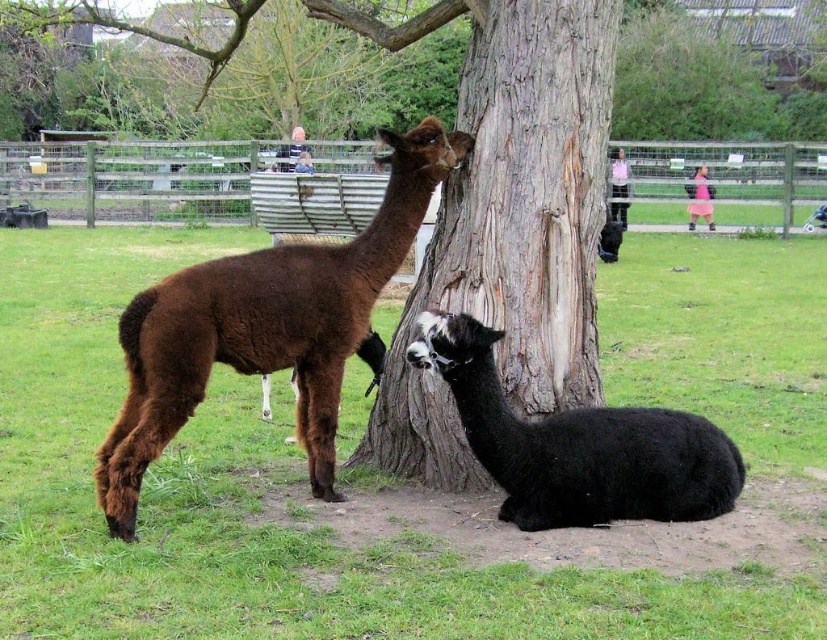
The height and width of the screenshot is (640, 827). I want to click on brown rough bark at center, so click(510, 232).

Looking at this image, who is higher up, brown rough bark at center or pink fabric skirt at upper right?

Positioned higher is pink fabric skirt at upper right.

Identify the location of brown rough bark at center. (x=510, y=232).

Between pink fabric dress at center and pink fabric skirt at upper right, which one is positioned lower?

pink fabric dress at center is below.

Does pink fabric dress at center appear under pink fabric skirt at upper right?

Indeed, pink fabric dress at center is positioned under pink fabric skirt at upper right.

Does point (614, 202) come farther from viewer compared to point (705, 177)?

No, it is in front of (705, 177).

Identify the location of pink fabric dress at center. This screenshot has width=827, height=640. (618, 186).

Is point (629, 436) behind point (692, 220)?

No.

In the scene shown: Between black woolly alpaca at lower center and pink fabric skirt at upper right, which one is positioned lower?

Positioned lower is black woolly alpaca at lower center.

The width and height of the screenshot is (827, 640). What do you see at coordinates (577, 444) in the screenshot?
I see `black woolly alpaca at lower center` at bounding box center [577, 444].

Locate an element on the screen. black woolly alpaca at lower center is located at coordinates (577, 444).